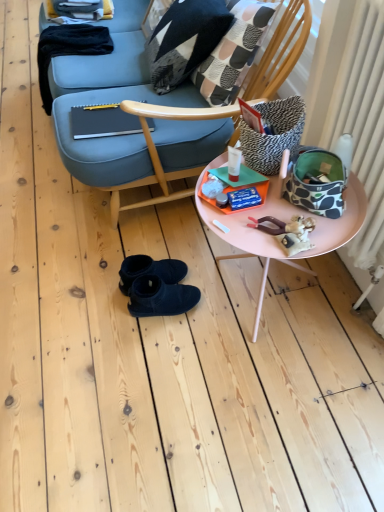
This screenshot has height=512, width=384. Describe the element at coordinates (356, 108) in the screenshot. I see `white textured radiator at right` at that location.

The image size is (384, 512). What do you see at coordinates (234, 51) in the screenshot? I see `patchwork fabric throw pillow at upper center` at bounding box center [234, 51].

I want to click on black-and-white geometric-patterned pillow at upper center, positioned as the 2th pillow in bottom-to-top order, so click(x=185, y=40).

Locate an element on the screen. black suede boots at center is located at coordinates (150, 270).

Can you tell me how much patchwork fabric throw pillow at upper center and pink plastic table at center differ in facing direction?

5.07 degrees separate the facing orientations of patchwork fabric throw pillow at upper center and pink plastic table at center.

Are patchwork fabric throw pillow at upper center and pink plastic table at center making contact?

No, patchwork fabric throw pillow at upper center is not with pink plastic table at center.

Could you tell me if patchwork fabric throw pillow at upper center is turned towards pink plastic table at center?

No, patchwork fabric throw pillow at upper center does not turn towards pink plastic table at center.

Is point (209, 70) farther from viewer compared to point (340, 238)?

Yes, point (209, 70) is behind point (340, 238).

Is point (243, 147) positioned after point (145, 260)?

No, (243, 147) is in front of (145, 260).

You are a GUI agent. You are given a task and a screenshot of the screen. Output one action in this format:
    pyautogui.click(x=<x>, y=<y>)
    Task: Click on the footwear to the left of zebra-patterned fabric pillow at upper right, the 1th pillow positioned from the bottom
    
    Given the screenshot: What is the action you would take?
    pyautogui.click(x=150, y=270)

Is zebra-patterned fabric pillow at upper right, positioned as the second pillow in left-to-right order, not close to black suede boots at center?

They are positioned close to each other.

What's the angular difference between zebra-patterned fabric pillow at upper right, the 1th pillow in the front-to-back sequence, and black suede boots at center's facing directions?

The angular difference between zebra-patterned fabric pillow at upper right, the 1th pillow in the front-to-back sequence, and black suede boots at center is 180 degrees.

From the image's perspective, is white textured radiator at right below black-and-white geometric-patterned pillow at upper center, which is counted as the first pillow, starting from the left?

Yes.

Which is farther from the camera, (x=338, y=57) or (x=171, y=30)?

The point (x=171, y=30) is farther from the camera.

Considering the positions of objects white textured radiator at right and black-and-white geometric-patterned pillow at upper center, positioned as the 2th pillow in bottom-to-top order, in the image provided, who is in front, white textured radiator at right or black-and-white geometric-patterned pillow at upper center, positioned as the 2th pillow in bottom-to-top order,?

Positioned in front is white textured radiator at right.

Who is shorter, white textured radiator at right or black-and-white geometric-patterned pillow at upper center, which is counted as the first pillow, starting from the left?

With less height is black-and-white geometric-patterned pillow at upper center, which is counted as the first pillow, starting from the left.

Who is bigger, black suede boots at center or patchwork fabric throw pillow at upper center?

patchwork fabric throw pillow at upper center is bigger.

Does black suede boots at center have a lesser height compared to patchwork fabric throw pillow at upper center?

Yes.

From a real-world perspective, which is physically above, black suede boots at center or patchwork fabric throw pillow at upper center?

patchwork fabric throw pillow at upper center.

Which is less distant, (184, 268) or (234, 64)?

Clearly, point (184, 268) is closer to the camera than point (234, 64).

Considering the points (243, 147) and (176, 35), which point is in front, point (243, 147) or point (176, 35)?

The point (243, 147) is closer.

From the picture: Is zebra-patterned fabric pillow at upper right, positioned as the 1th pillow in right-to-left order, to the right of black-and-white geometric-patterned pillow at upper center, the 1th pillow positioned from the top, from the viewer's perspective?

Yes.

Looking at this image, from a real-world perspective, is zebra-patterned fabric pillow at upper right, positioned as the second pillow in left-to-right order, below black-and-white geometric-patterned pillow at upper center, which ranks as the second pillow in front-to-back order?

No.

Is white textured radiator at right not inside zebra-patterned fabric pillow at upper right, positioned as the 1th pillow in right-to-left order?

Yes, white textured radiator at right is located beyond the bounds of zebra-patterned fabric pillow at upper right, positioned as the 1th pillow in right-to-left order.

Which object is wider, white textured radiator at right or zebra-patterned fabric pillow at upper right, the 1th pillow in the front-to-back sequence?

zebra-patterned fabric pillow at upper right, the 1th pillow in the front-to-back sequence.

From a real-world perspective, relative to zebra-patterned fabric pillow at upper right, the 1th pillow positioned from the bottom, is white textured radiator at right vertically above or below?

white textured radiator at right is situated lower than zebra-patterned fabric pillow at upper right, the 1th pillow positioned from the bottom, in the real world.

Is black-and-white geometric-patterned pillow at upper center, the 2th pillow viewed from the right, turned away from patchwork fabric throw pillow at upper center?

Yes, patchwork fabric throw pillow at upper center is at the back of black-and-white geometric-patterned pillow at upper center, the 2th pillow viewed from the right.

From the picture: Can you confirm if black-and-white geometric-patterned pillow at upper center, marked as the first pillow in a back-to-front arrangement, is wider than patchwork fabric throw pillow at upper center?

In fact, black-and-white geometric-patterned pillow at upper center, marked as the first pillow in a back-to-front arrangement, might be narrower than patchwork fabric throw pillow at upper center.

Find the location of a particular element. Image resolution: width=384 pixels, height=512 pixels. pillow behind the patchwork fabric throw pillow at upper center is located at coordinates click(x=185, y=40).

Who is shorter, black-and-white geometric-patterned pillow at upper center, which is counted as the first pillow, starting from the left, or patchwork fabric throw pillow at upper center?

Standing shorter between the two is black-and-white geometric-patterned pillow at upper center, which is counted as the first pillow, starting from the left.

At what (x,y) coordinates should I click in order to perform the action: click on throw pillow that appears above the pink plastic table at center (from the image's perspective). Please return your answer as a coordinate pair (x, y). The width and height of the screenshot is (384, 512). Looking at the image, I should click on (234, 51).

Locate an element on the screen. This screenshot has height=512, width=384. footwear that is on the left side of zebra-patterned fabric pillow at upper right, positioned as the 1th pillow in right-to-left order is located at coordinates (x=150, y=270).

Estimate the real-world distances between objects in this image. Which object is closer to black suede boots at center, black-and-white geometric-patterned pillow at upper center, positioned as the 2th pillow in bottom-to-top order, or white textured radiator at right?

Among the two, white textured radiator at right is located nearer to black suede boots at center.

Estimate the real-world distances between objects in this image. Which object is closer to white textured radiator at right, black suede boots at center or zebra-patterned fabric pillow at upper right, the 1th pillow positioned from the bottom?

zebra-patterned fabric pillow at upper right, the 1th pillow positioned from the bottom, is closer to white textured radiator at right.

Estimate the real-world distances between objects in this image. Which object is further from black-and-white geometric-patterned pillow at upper center, the 1th pillow positioned from the top, pink plastic table at center or zebra-patterned fabric pillow at upper right, arranged as the second pillow when viewed from the top?

pink plastic table at center is positioned further to the anchor black-and-white geometric-patterned pillow at upper center, the 1th pillow positioned from the top.

Considering their positions, is black-and-white geometric-patterned pillow at upper center, positioned as the 2th pillow in bottom-to-top order, positioned closer to zebra-patterned fabric pillow at upper right, marked as the second pillow in a back-to-front arrangement, than pink plastic table at center?

Based on the image, pink plastic table at center appears to be nearer to zebra-patterned fabric pillow at upper right, marked as the second pillow in a back-to-front arrangement.

Which object lies further to the anchor point patchwork fabric throw pillow at upper center, black-and-white geometric-patterned pillow at upper center, marked as the first pillow in a back-to-front arrangement, or black suede boots at center?

black suede boots at center is positioned further to the anchor patchwork fabric throw pillow at upper center.

Considering their positions, is pink plastic table at center positioned further to patchwork fabric throw pillow at upper center than zebra-patterned fabric pillow at upper right, the 1th pillow in the front-to-back sequence?

pink plastic table at center.

Based on their spatial positions, is black suede boots at center or black-and-white geometric-patterned pillow at upper center, which is counted as the first pillow, starting from the left, further from zebra-patterned fabric pillow at upper right, marked as the second pillow in a back-to-front arrangement?

black-and-white geometric-patterned pillow at upper center, which is counted as the first pillow, starting from the left, is positioned further to the anchor zebra-patterned fabric pillow at upper right, marked as the second pillow in a back-to-front arrangement.

Based on their spatial positions, is pink plastic table at center or black-and-white geometric-patterned pillow at upper center, which is counted as the first pillow, starting from the left, further from patchwork fabric throw pillow at upper center?

pink plastic table at center is further to patchwork fabric throw pillow at upper center.

I want to click on pillow between black-and-white geometric-patterned pillow at upper center, positioned as the 2th pillow in bottom-to-top order, and white textured radiator at right from top to bottom, so click(274, 134).

You are a GUI agent. You are given a task and a screenshot of the screen. Output one action in this format:
    pyautogui.click(x=<x>, y=<y>)
    Task: Click on the throw pillow that lies between black-and-white geometric-patterned pillow at upper center, the 1th pillow positioned from the top, and white textured radiator at right from top to bottom
    
    Given the screenshot: What is the action you would take?
    pyautogui.click(x=234, y=51)

Find the location of a particular element. This screenshot has height=512, width=384. radiator between patchwork fabric throw pillow at upper center and black suede boots at center in the vertical direction is located at coordinates (356, 108).

At what (x,y) coordinates should I click in order to perform the action: click on pillow between patchwork fabric throw pillow at upper center and white textured radiator at right in the up-down direction. Please return your answer as a coordinate pair (x, y). The width and height of the screenshot is (384, 512). Looking at the image, I should click on (274, 134).